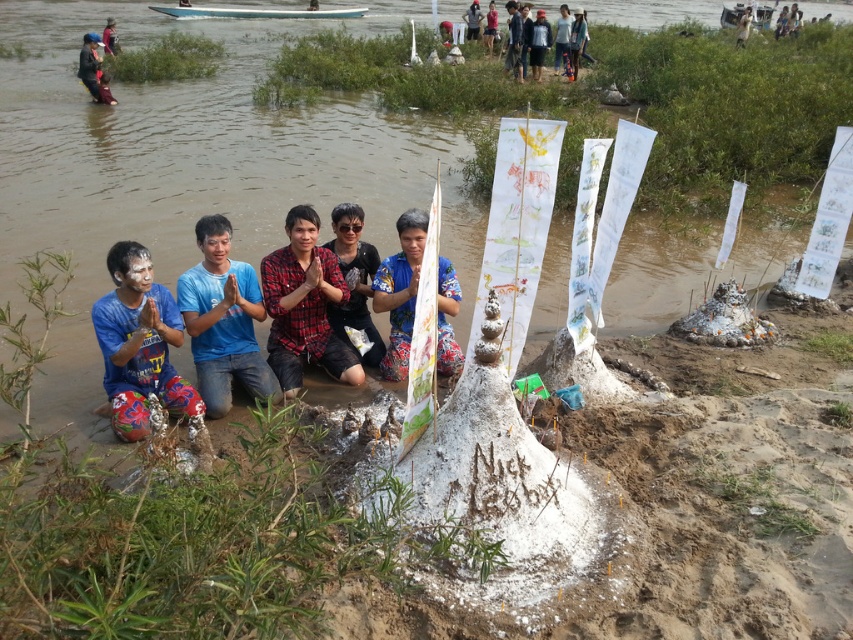
You are a photographer trying to capture a closeup shot of the red plaid shirt at center and the matte black shirt at center. Your camera has a maximum focus range of 12 inches. Can you focus on both subjects simultaneously?

The red plaid shirt at center is 13.39 inches from the matte black shirt at center. Since the distance between them exceeds the camera maximum focus range of 12 inches, you cannot focus on both subjects simultaneously.

You are a photographer standing at the edge of the riverbank. You want to take a photo of the five individuals kneeling on the muddy ground. Where should you position yourself to ensure the printed fabric shirt at center is in the center of your photo?

To center the printed fabric shirt at center in your photo, position yourself directly in line with its coordinates at point (399,291).